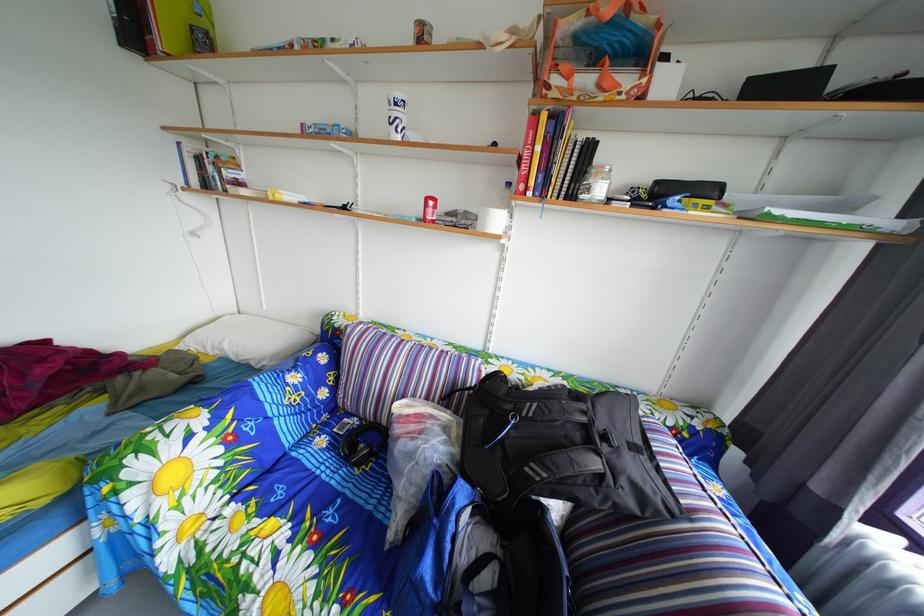
Identify the location of sofa sitting surface. (347, 507).